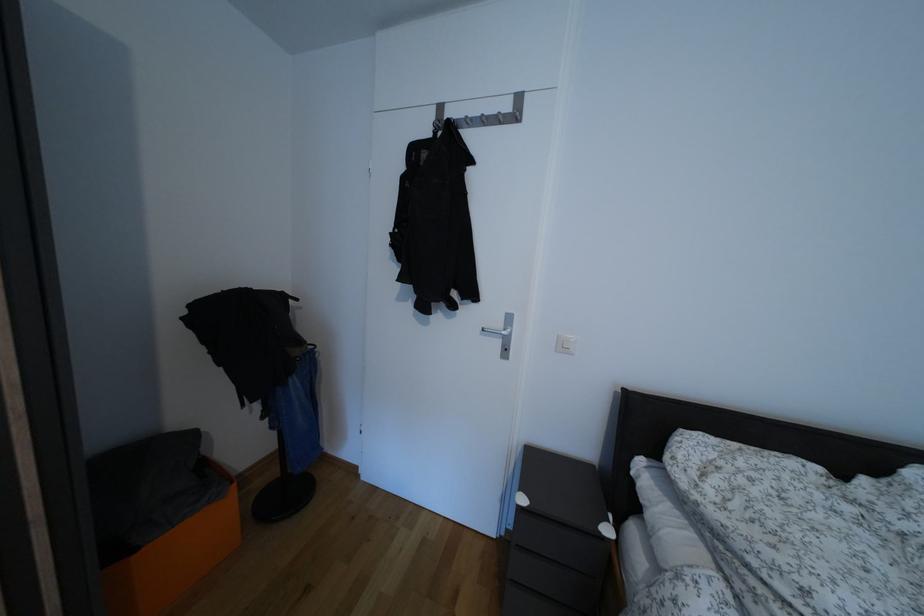
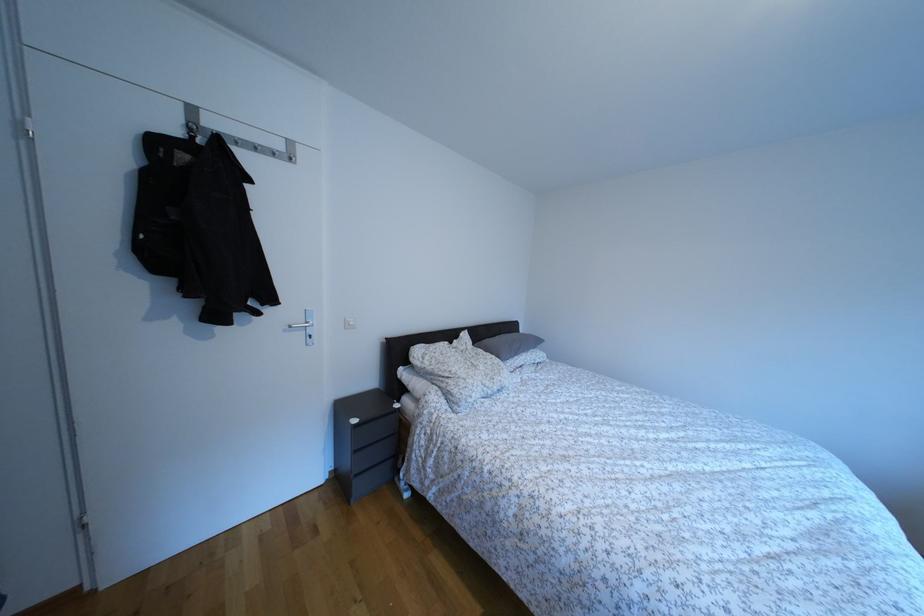
In the second image, find the point that corresponds to (x=514, y=113) in the first image.

(286, 152)